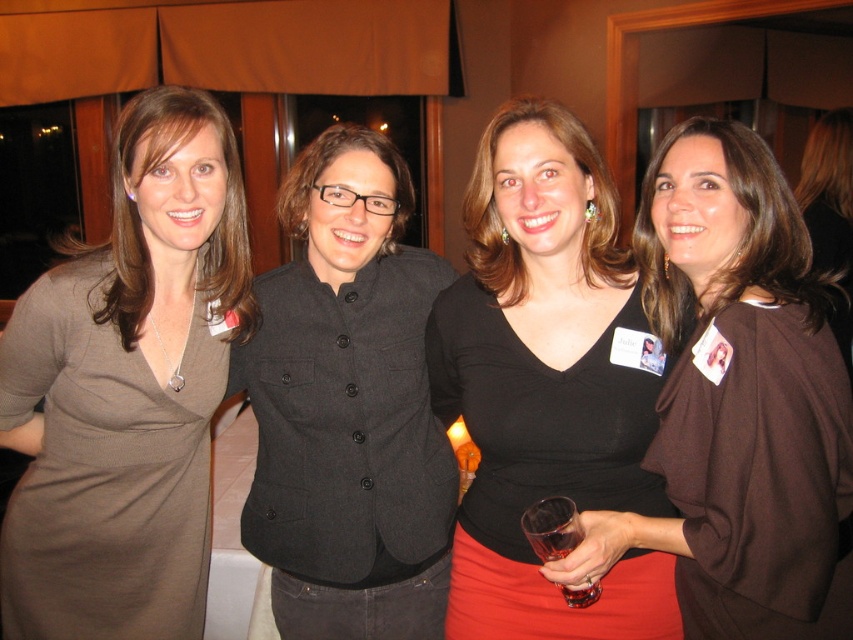
Question: Is brown matte dress at center closer to the viewer compared to transparent glass at lower center?

Choices:
 (A) yes
 (B) no

Answer: (A)

Question: Which object appears farthest from the camera in this image?

Choices:
 (A) charcoal wool blazer at center
 (B) brown matte blazer at right
 (C) transparent glass at lower center

Answer: (B)

Question: Which of the following is the closest to the observer?

Choices:
 (A) (378, 230)
 (B) (178, 438)
 (C) (706, 486)

Answer: (C)

Question: From the image, what is the correct spatial relationship of brown matte dress at center in relation to brown matte blazer at right?

Choices:
 (A) below
 (B) above

Answer: (A)

Question: From the image, what is the correct spatial relationship of brown matte dress at center in relation to charcoal wool blazer at center?

Choices:
 (A) above
 (B) below

Answer: (A)

Question: Which object appears farthest from the camera in this image?

Choices:
 (A) brown matte dress at center
 (B) black matte dress at center
 (C) brown matte blazer at right
 (D) transparent glass at lower center

Answer: (C)